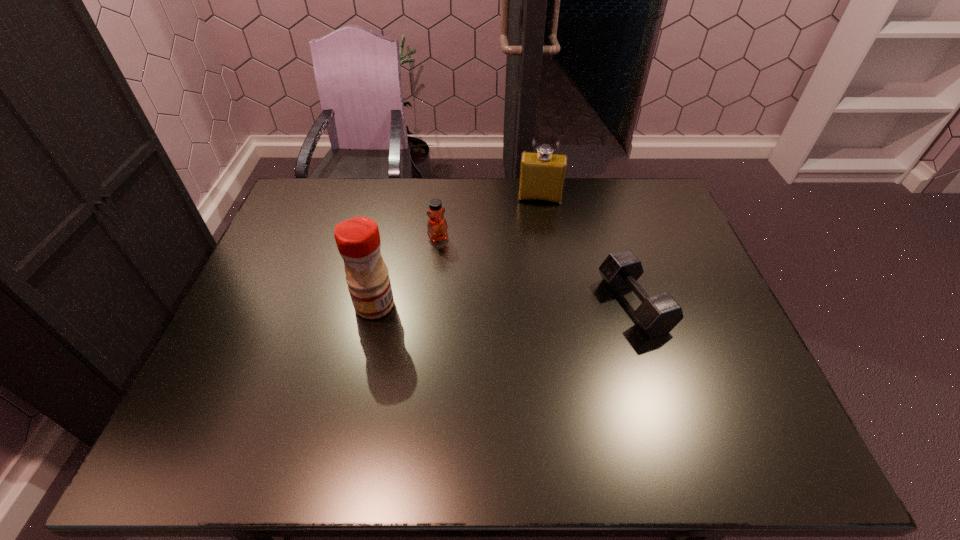
Where is `condiment`? This screenshot has height=540, width=960. condiment is located at coordinates (358, 241).

You are a GUI agent. You are given a task and a screenshot of the screen. Output one action in this format:
    pyautogui.click(x=<x>, y=<y>)
    Task: Click on the leftmost object
    The width and height of the screenshot is (960, 540).
    Given the screenshot: What is the action you would take?
    pyautogui.click(x=358, y=241)

I want to click on dumbbell, so click(x=657, y=315).

Where is `the shortest object`? This screenshot has width=960, height=540. the shortest object is located at coordinates (657, 315).

Find the location of a particular element. The image size is (960, 540). the second object from right to left is located at coordinates (542, 174).

At what (x,y) coordinates should I click in order to perform the action: click on the farthest object. Please return your answer as a coordinate pair (x, y). Looking at the image, I should click on (542, 174).

Find the location of a particular element. This screenshot has height=540, width=960. the third object from right to left is located at coordinates (437, 226).

The width and height of the screenshot is (960, 540). Find the location of `the third tallest object`. the third tallest object is located at coordinates (437, 226).

You are a GUI agent. You are given a task and a screenshot of the screen. Output one action in this format:
    pyautogui.click(x=<x>, y=<y>)
    Task: Click on the vacant point located on the right of the condiment
    
    Given the screenshot: What is the action you would take?
    pyautogui.click(x=540, y=305)

What are the coordinates of `vacant region located on the left of the shortest object` in the screenshot? It's located at (582, 305).